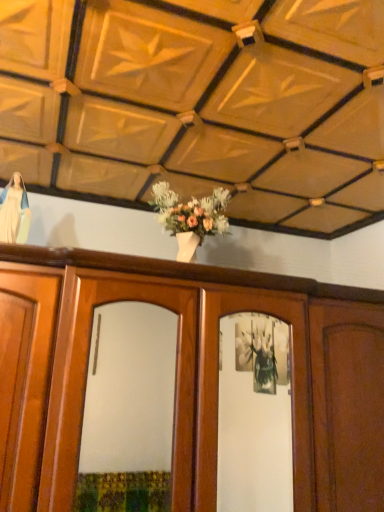
Question: From the image's perspective, would you say wooden cabinet at center is shown under white glossy statue at upper left?

Choices:
 (A) no
 (B) yes

Answer: (B)

Question: Does wooden cabinet at center contain white glossy statue at upper left?

Choices:
 (A) no
 (B) yes

Answer: (A)

Question: Is wooden cabinet at center bigger than white glossy statue at upper left?

Choices:
 (A) no
 (B) yes

Answer: (B)

Question: From the image's perspective, is wooden cabinet at center located above white glossy statue at upper left?

Choices:
 (A) no
 (B) yes

Answer: (A)

Question: Is wooden cabinet at center closer to the viewer compared to white glossy statue at upper left?

Choices:
 (A) no
 (B) yes

Answer: (B)

Question: Is wooden cabinet at center positioned behind white glossy statue at upper left?

Choices:
 (A) yes
 (B) no

Answer: (B)

Question: Can you confirm if white glossy statue at upper left is taller than wooden cabinet at center?

Choices:
 (A) no
 (B) yes

Answer: (A)

Question: Is white glossy statue at upper left far away from wooden cabinet at center?

Choices:
 (A) yes
 (B) no

Answer: (B)

Question: From the image's perspective, would you say white glossy statue at upper left is shown under wooden cabinet at center?

Choices:
 (A) no
 (B) yes

Answer: (A)

Question: Can you confirm if white glossy statue at upper left is positioned to the left of wooden cabinet at center?

Choices:
 (A) no
 (B) yes

Answer: (B)

Question: Does white glossy statue at upper left have a smaller size compared to wooden cabinet at center?

Choices:
 (A) no
 (B) yes

Answer: (B)

Question: Is the position of white glossy statue at upper left less distant than that of wooden cabinet at center?

Choices:
 (A) no
 (B) yes

Answer: (A)

Question: Is wooden cabinet at center to the left or to the right of white glossy statue at upper left in the image?

Choices:
 (A) right
 (B) left

Answer: (A)